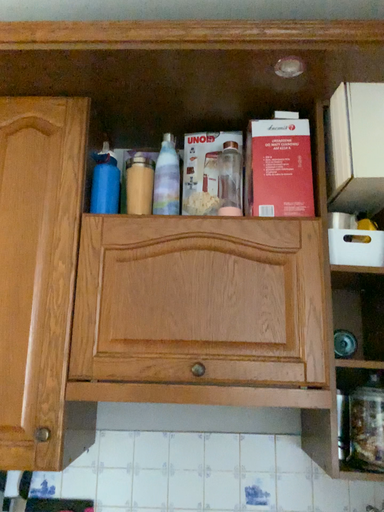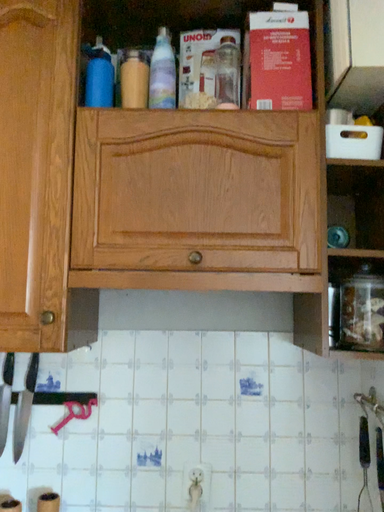
Question: How did the camera likely rotate when shooting the video?

Choices:
 (A) rotated upward
 (B) rotated downward

Answer: (B)